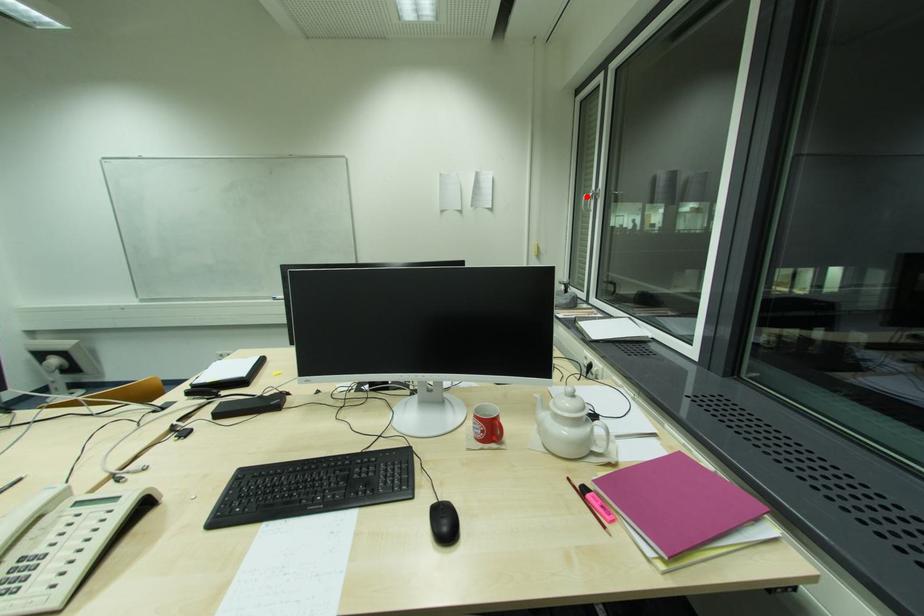
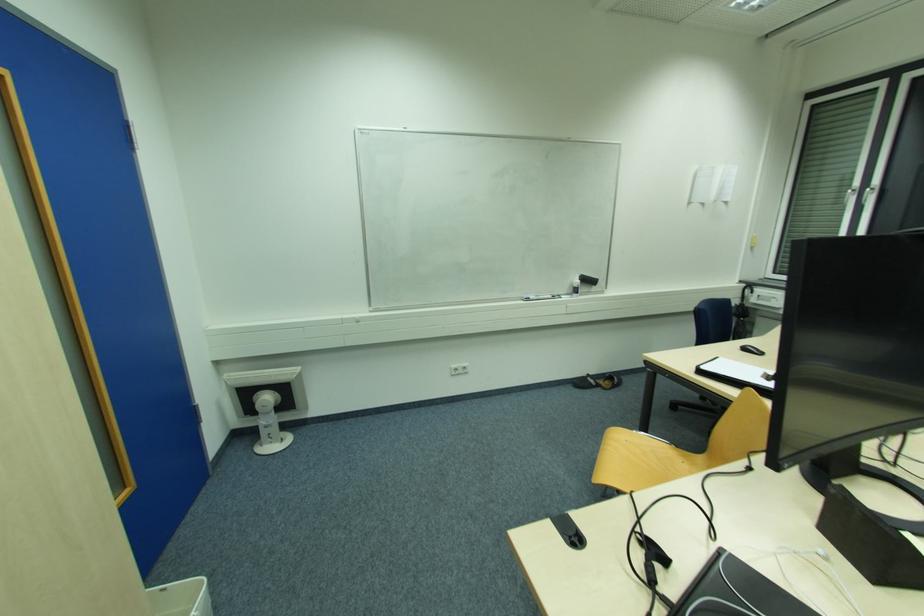
The point at the highlighted location is marked in the first image. Where is the corresponding point in the second image?

(852, 191)